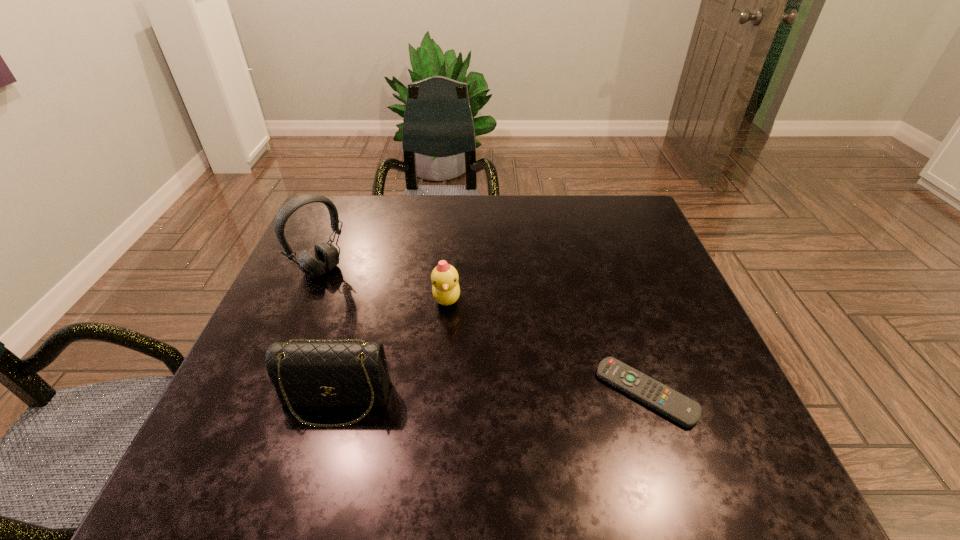
Locate an element on the screen. The width and height of the screenshot is (960, 540). vacant space at the left edge of the desktop is located at coordinates (284, 321).

Identify the location of free region at the right edge of the desktop. (675, 320).

The width and height of the screenshot is (960, 540). I want to click on vacant space at the far right corner of the desktop, so click(591, 225).

Locate an element on the screen. This screenshot has width=960, height=540. vacant space in between the clutch bag and the headset is located at coordinates (328, 335).

Where is `vacant area between the rightmost object and the second object from right to left`? The width and height of the screenshot is (960, 540). vacant area between the rightmost object and the second object from right to left is located at coordinates (546, 346).

This screenshot has width=960, height=540. In order to click on vacant area that lies between the clutch bag and the third object from left to right in this screenshot , I will do `click(392, 349)`.

In order to click on vacant area that lies between the second object from right to left and the shortest object in this screenshot , I will do `click(546, 346)`.

Identify the location of vacant region between the clutch bag and the rightmost object. This screenshot has height=540, width=960. (491, 396).

Where is `empty space between the clutch bag and the remote control`? The height and width of the screenshot is (540, 960). empty space between the clutch bag and the remote control is located at coordinates (491, 396).

The height and width of the screenshot is (540, 960). Find the location of `free space between the tallest object and the rightmost object`. free space between the tallest object and the rightmost object is located at coordinates (484, 331).